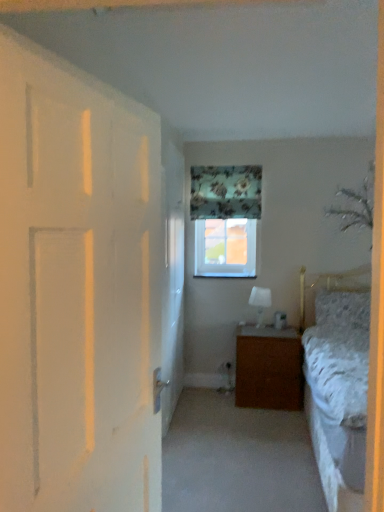
At what (x,y) coordinates should I click in order to perform the action: click on free spot in front of brown wooden nightstand at center. Please return your answer as a coordinate pair (x, y). The height and width of the screenshot is (512, 384). Looking at the image, I should click on (264, 418).